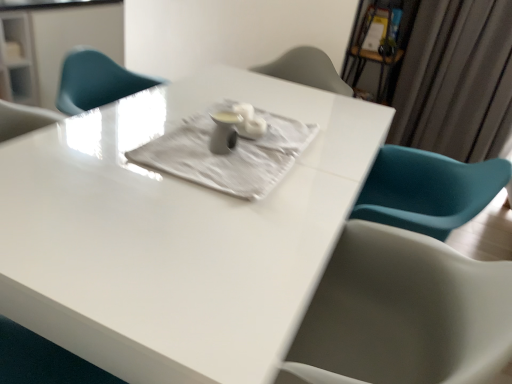
Where is `vacant space to the right of white textured cloth at center`? This screenshot has width=512, height=384. vacant space to the right of white textured cloth at center is located at coordinates (340, 153).